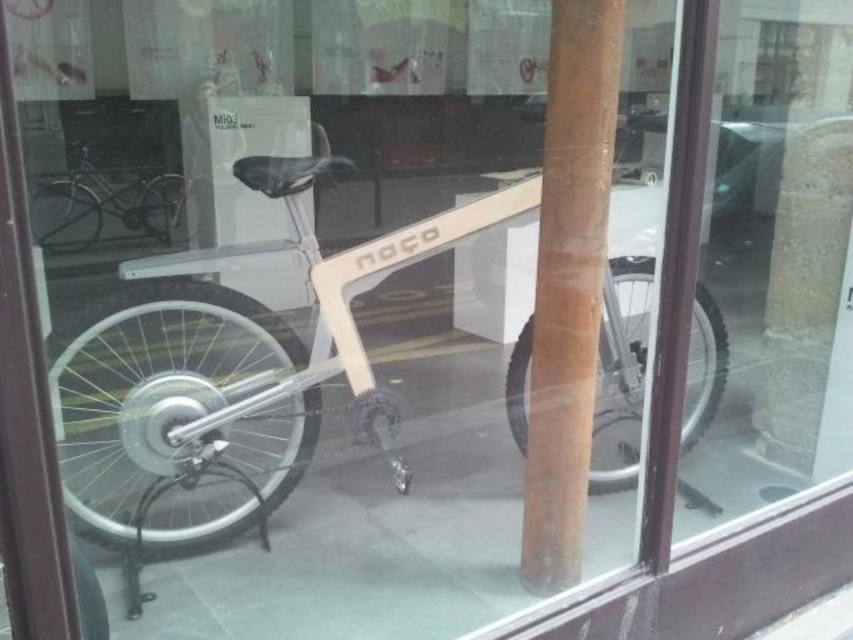
Question: Can you confirm if brown wood pole at center is thinner than matte black bicycle at upper left?

Choices:
 (A) no
 (B) yes

Answer: (B)

Question: Which point is closer to the camera?

Choices:
 (A) brown wood pole at center
 (B) matte black bicycle at upper left

Answer: (A)

Question: Which point appears closest to the camera in this image?

Choices:
 (A) (70, 241)
 (B) (595, 300)

Answer: (B)

Question: Where is brown wood pole at center located in relation to matte black bicycle at upper left in the image?

Choices:
 (A) below
 (B) above

Answer: (A)

Question: Is brown wood pole at center smaller than matte black bicycle at upper left?

Choices:
 (A) no
 (B) yes

Answer: (B)